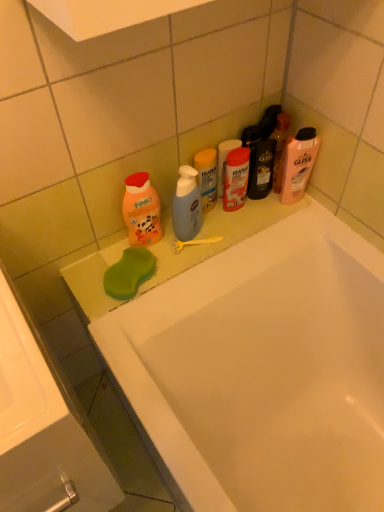
Locate an element on the screen. vacant area that is in front of translucent plastic bottle at center, the second cleaning product positioned from the right is located at coordinates (204, 239).